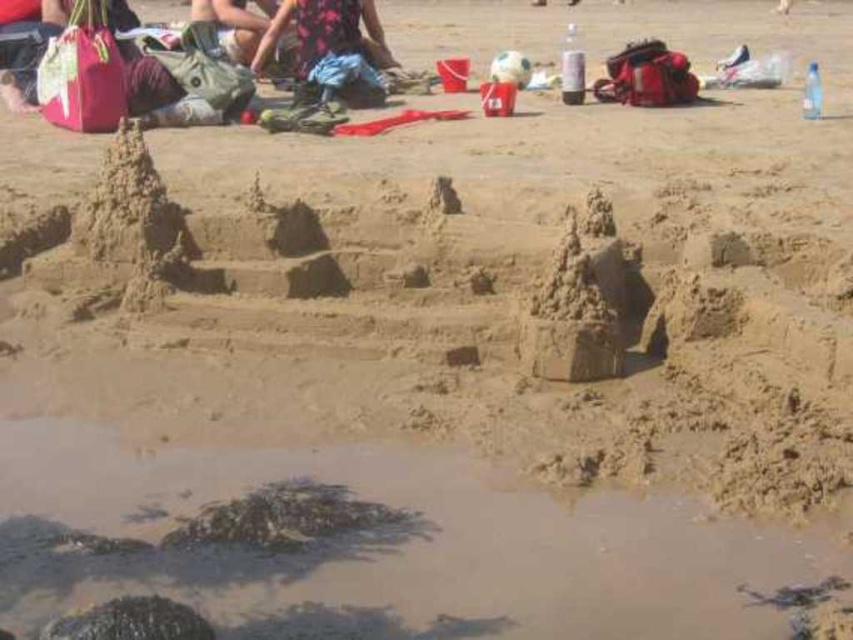
Does floral dress at center have a greater width compared to green fabric bag at upper left?

Correct, the width of floral dress at center exceeds that of green fabric bag at upper left.

Can you confirm if floral dress at center is positioned above green fabric bag at upper left?

No.

Is point (299, 45) positioned behind point (271, 0)?

No, it is in front of (271, 0).

In order to click on floral dress at center in this screenshot , I will do `click(325, 33)`.